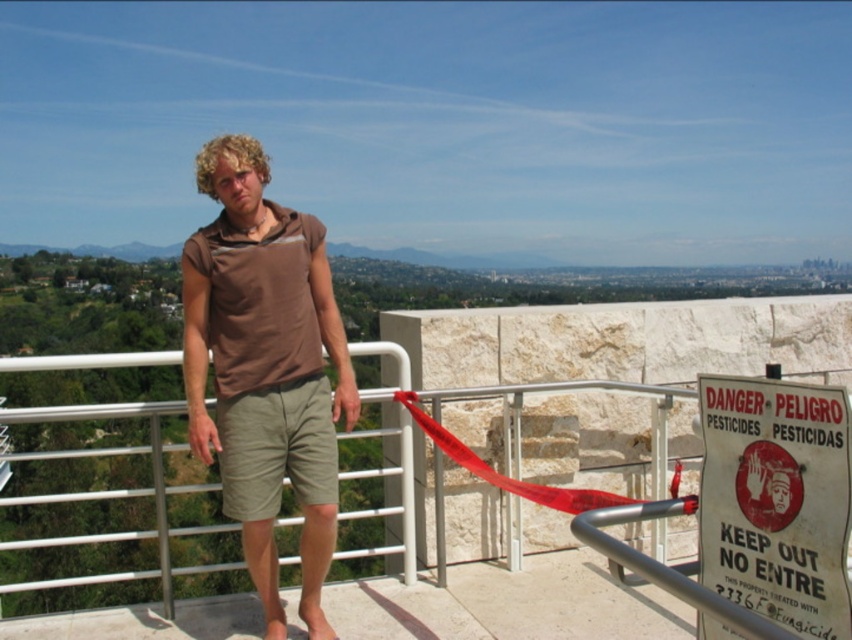
You are a safety inspector evaluating the balcony setup. The brown cotton shirt at center and the red fabric ribbon at center must be at least 5 feet apart for safety compliance. Are they compliant?

The brown cotton shirt at center is 3.44 feet away from the red fabric ribbon at center. Since 3.44 feet is less than the required 5 feet, they are not compliant with safety regulations.

You are a hiker who just arrived at the platform. You notice the brown cotton shirt at center and the white paper sign at right. Which item is closer to the edge of the platform?

The white paper sign at right is closer to the edge of the platform because the brown cotton shirt at center is to the left of it, meaning the sign is positioned further towards the edge.